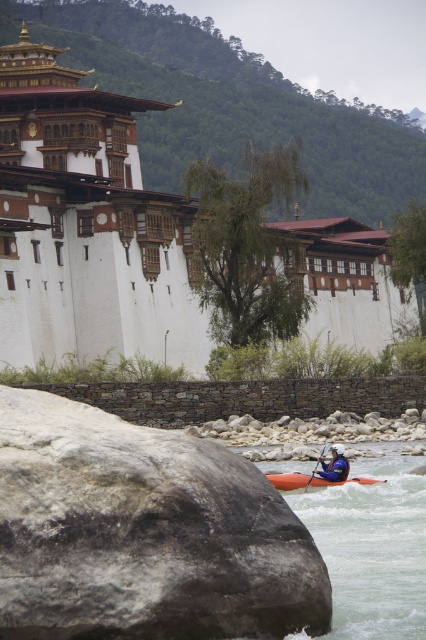
Question: Can you confirm if orange matte kayak at lower center is positioned above orange plastic paddle at lower center?

Choices:
 (A) yes
 (B) no

Answer: (B)

Question: Does rough gray rock at lower left appear over orange matte kayak at lower center?

Choices:
 (A) no
 (B) yes

Answer: (B)

Question: Can you confirm if rough gray rock at lower left is bigger than white painted stone building at upper left?

Choices:
 (A) yes
 (B) no

Answer: (B)

Question: Which is nearer to the rough gray rock at lower left?

Choices:
 (A) orange matte kayak at lower center
 (B) blue fabric helmet at lower center
 (C) white painted stone building at upper left

Answer: (A)

Question: Estimate the real-world distances between objects in this image. Which object is farther from the rough gray rock at lower left?

Choices:
 (A) blue fabric helmet at lower center
 (B) orange plastic paddle at lower center
 (C) white painted stone building at upper left

Answer: (C)

Question: Which of the following is the farthest from the observer?

Choices:
 (A) orange plastic paddle at lower center
 (B) orange matte kayak at lower center
 (C) blue fabric helmet at lower center

Answer: (C)